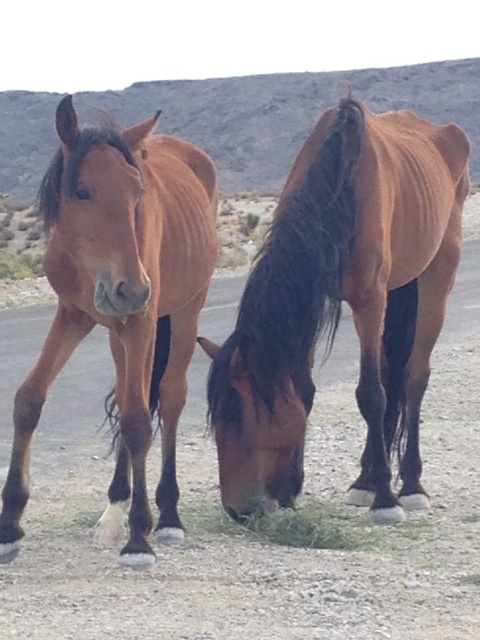
Question: Can you confirm if brown glossy horse at center is positioned to the right of brown glossy horse at left?

Choices:
 (A) no
 (B) yes

Answer: (B)

Question: Which point is closer to the camera taking this photo?

Choices:
 (A) (84, 312)
 (B) (299, 536)
 (C) (232, 392)

Answer: (A)

Question: From the image, what is the correct spatial relationship of brown glossy horse at center in relation to green grass at lower center?

Choices:
 (A) left
 (B) right

Answer: (B)

Question: Can you confirm if brown glossy horse at left is bigger than green grass at lower center?

Choices:
 (A) yes
 (B) no

Answer: (A)

Question: Among these objects, which one is nearest to the camera?

Choices:
 (A) brown glossy horse at center
 (B) brown glossy horse at left
 (C) green grass at lower center

Answer: (B)

Question: Which object is farther from the camera taking this photo?

Choices:
 (A) brown glossy horse at center
 (B) green grass at lower center
 (C) brown glossy horse at left

Answer: (B)